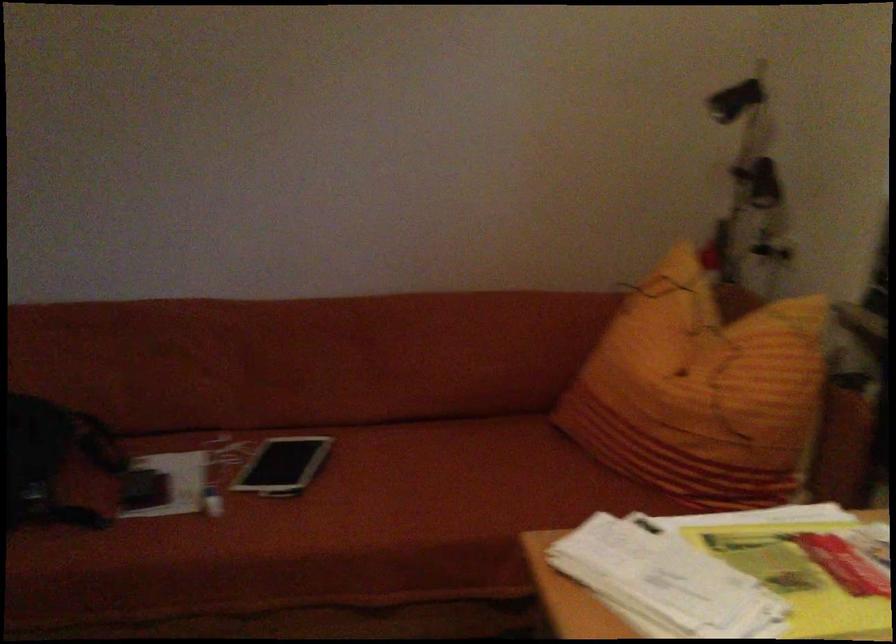
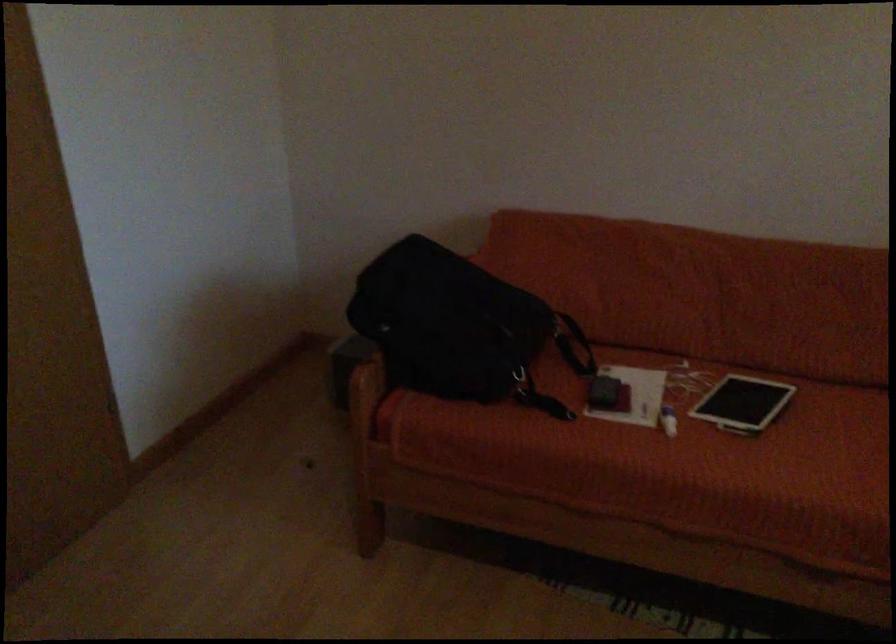
Locate, in the second image, the point that corresponds to pixel 205 504 in the first image.

(668, 420)